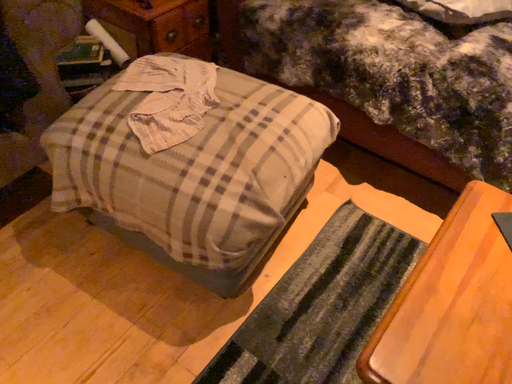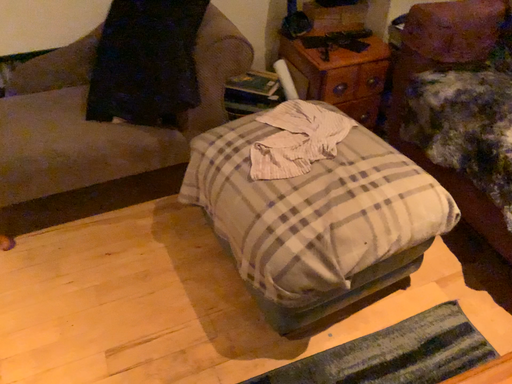
Question: How did the camera likely rotate when shooting the video?

Choices:
 (A) rotated right
 (B) rotated left

Answer: (B)